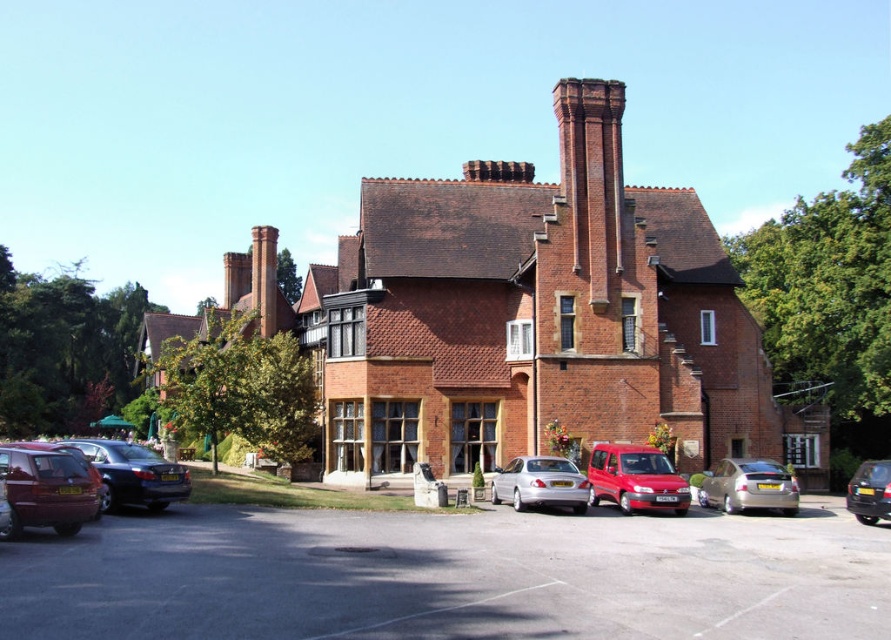
Between point (595, 298) and point (705, 492), which one is positioned in front?

Point (705, 492)

Does brick chimney at upper center have a lesser height compared to silver metallic sedan at lower right?

No.

At what (x,y) coordinates should I click in order to perform the action: click on brick chimney at upper center. Please return your answer as a coordinate pair (x, y). This screenshot has width=891, height=640. Looking at the image, I should click on (593, 177).

Is brick chimney at upper center to the right of maroon matte van at lower left from the viewer's perspective?

Correct, you'll find brick chimney at upper center to the right of maroon matte van at lower left.

Who is taller, brick chimney at upper center or maroon matte van at lower left?

Standing taller between the two is brick chimney at upper center.

The height and width of the screenshot is (640, 891). I want to click on brick chimney at upper center, so click(x=593, y=177).

The height and width of the screenshot is (640, 891). In order to click on brick chimney at upper center in this screenshot , I will do `click(593, 177)`.

Is point (64, 442) less distant than point (881, 502)?

No.

Is point (172, 476) less distant than point (856, 481)?

Yes, point (172, 476) is in front of point (856, 481).

The image size is (891, 640). In order to click on shiny black sedan at lower left in this screenshot , I will do `click(135, 474)`.